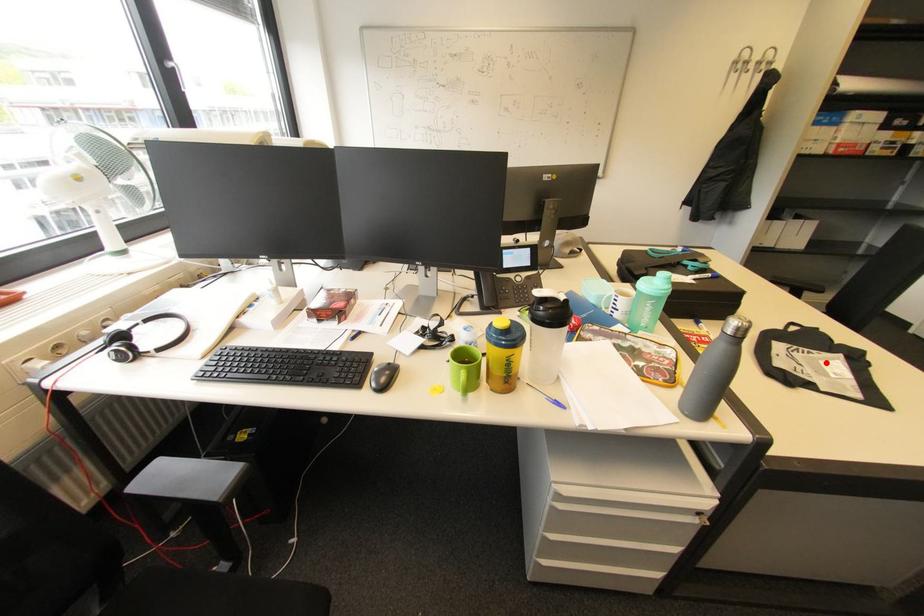
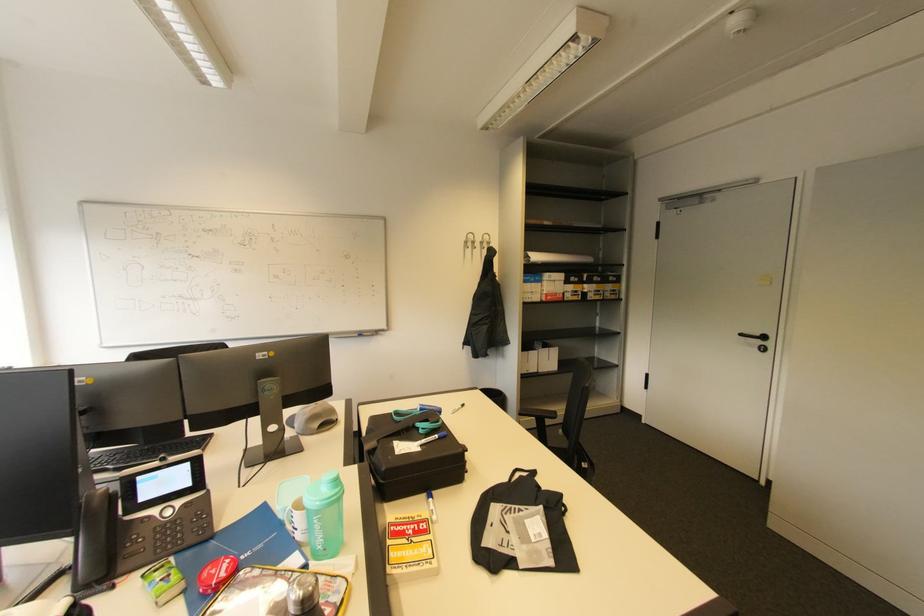
Locate, in the second image, the point that corresponds to the highlighted location in the first image.

(531, 523)